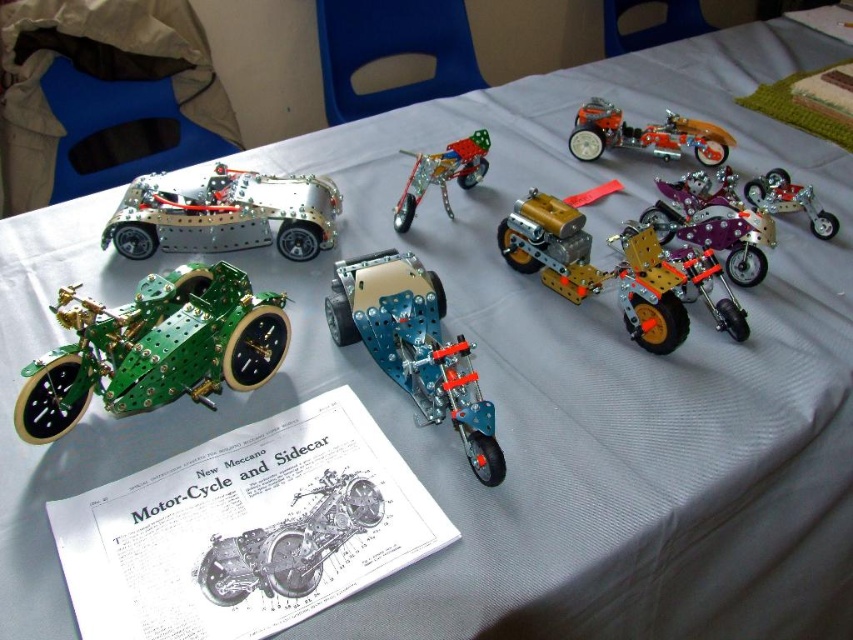
You are standing at the edge of the table looking at the miniature models. There is a point marked at coordinate (154, 348). Which object is located at that point?

The point at coordinate (154, 348) corresponds to the green metallic motorcycle at center left.